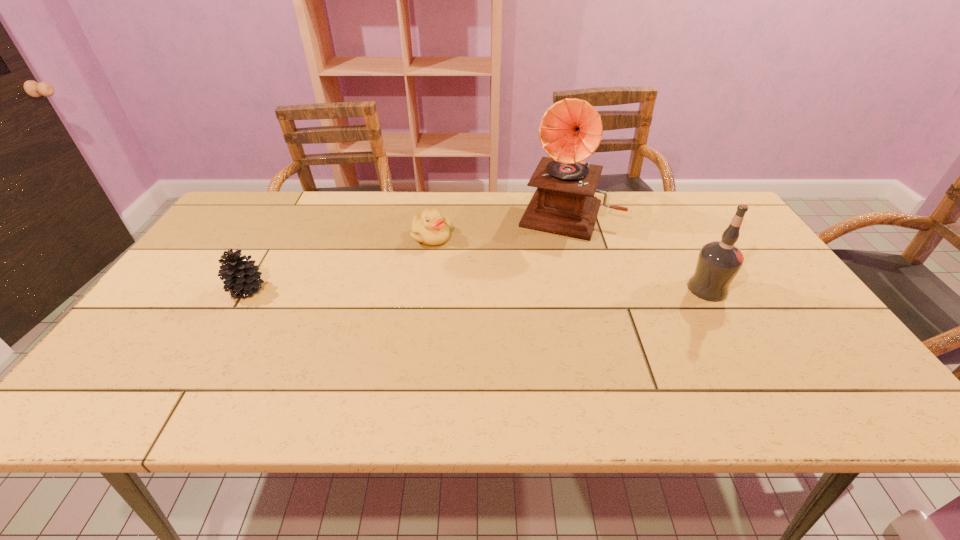
The width and height of the screenshot is (960, 540). In order to click on vacant space at the near edge in this screenshot , I will do `click(196, 366)`.

You are a GUI agent. You are given a task and a screenshot of the screen. Output one action in this format:
    pyautogui.click(x=<x>, y=<y>)
    Task: Click on the free space at the right edge of the desktop
    The height and width of the screenshot is (540, 960).
    Given the screenshot: What is the action you would take?
    pyautogui.click(x=786, y=295)

This screenshot has height=540, width=960. I want to click on vacant space at the far left corner of the desktop, so click(233, 224).

Find the location of a particular element. This screenshot has width=960, height=540. vacant space at the near left corner of the desktop is located at coordinates (154, 357).

In the image, there is a desktop. Identify the location of blank space at the far right corner. (713, 199).

The image size is (960, 540). I want to click on blank region between the phonograph record and the duckling, so click(x=500, y=225).

You are a GUI agent. You are given a task and a screenshot of the screen. Output one action in this format:
    pyautogui.click(x=<x>, y=<y>)
    Task: Click on the vacant region between the tallest object and the second object from left to right
    
    Given the screenshot: What is the action you would take?
    pyautogui.click(x=500, y=225)

I want to click on vacant region between the leftmost object and the vodka, so click(x=477, y=289).

At what (x,y) coordinates should I click in order to perform the action: click on unoccupied area between the duckling and the leftmost object. Please return your answer as a coordinate pair (x, y). The width and height of the screenshot is (960, 540). Looking at the image, I should click on (339, 263).

Where is `free space between the shortest object and the leftmost object`? The image size is (960, 540). free space between the shortest object and the leftmost object is located at coordinates (339, 263).